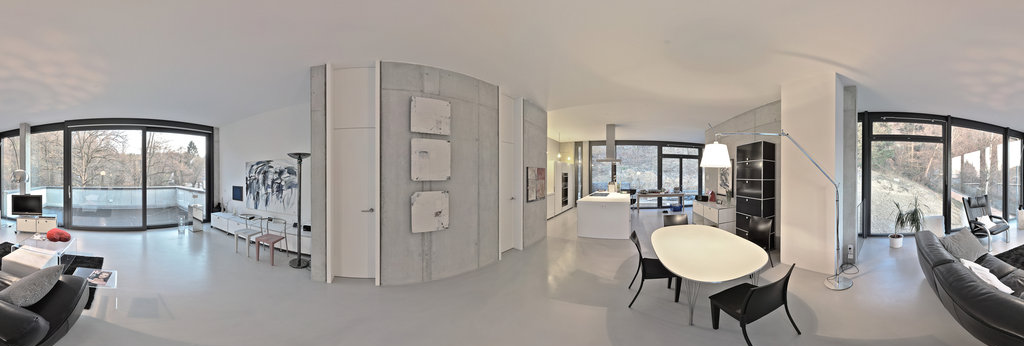
Image resolution: width=1024 pixels, height=346 pixels. Find the location of `tv`. tv is located at coordinates (28, 207).